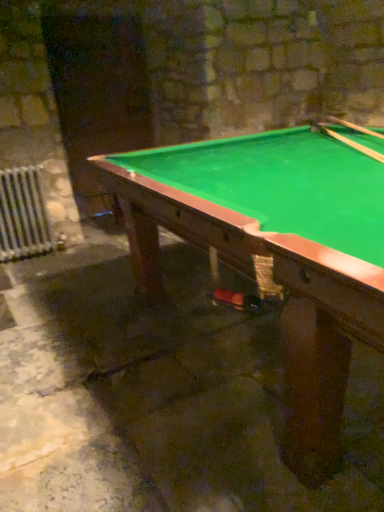
Question: From the image's perspective, is green felt pool table at center on white metal radiator at lower left?

Choices:
 (A) yes
 (B) no

Answer: (B)

Question: Is green felt pool table at center to the left of white metal radiator at lower left from the viewer's perspective?

Choices:
 (A) no
 (B) yes

Answer: (A)

Question: Is green felt pool table at center far away from white metal radiator at lower left?

Choices:
 (A) no
 (B) yes

Answer: (B)

Question: Considering the relative sizes of green felt pool table at center and white metal radiator at lower left in the image provided, is green felt pool table at center shorter than white metal radiator at lower left?

Choices:
 (A) no
 (B) yes

Answer: (A)

Question: Can you confirm if green felt pool table at center is wider than white metal radiator at lower left?

Choices:
 (A) no
 (B) yes

Answer: (B)

Question: Considering the positions of green felt pool table at center and wooden smooth cue at upper right, placed as the first cue when sorted from right to left, in the image, is green felt pool table at center taller or shorter than wooden smooth cue at upper right, placed as the first cue when sorted from right to left,?

Choices:
 (A) tall
 (B) short

Answer: (A)

Question: From the image's perspective, relative to wooden smooth cue at upper right, placed as the first cue when sorted from right to left, is green felt pool table at center above or below?

Choices:
 (A) above
 (B) below

Answer: (B)

Question: Based on their sizes in the image, would you say green felt pool table at center is bigger or smaller than wooden smooth cue at upper right, the 2th cue viewed from the left?

Choices:
 (A) big
 (B) small

Answer: (A)

Question: In the image, is green felt pool table at center on the left side or the right side of wooden smooth cue at upper right, the 2th cue viewed from the left?

Choices:
 (A) left
 (B) right

Answer: (A)

Question: Is green felt pool table at center bigger or smaller than white metal radiator at lower left?

Choices:
 (A) big
 (B) small

Answer: (A)

Question: Is green felt pool table at center to the left or to the right of white metal radiator at lower left in the image?

Choices:
 (A) left
 (B) right

Answer: (B)

Question: In the image, is green felt pool table at center positioned in front of or behind white metal radiator at lower left?

Choices:
 (A) behind
 (B) front

Answer: (B)

Question: Considering the positions of green felt pool table at center and white metal radiator at lower left in the image, is green felt pool table at center taller or shorter than white metal radiator at lower left?

Choices:
 (A) short
 (B) tall

Answer: (B)

Question: In terms of width, does wooden smooth cue at upper right, the 2th cue viewed from the left, look wider or thinner when compared to green felt pool table at center?

Choices:
 (A) wide
 (B) thin

Answer: (B)

Question: From the image's perspective, relative to green felt pool table at center, is wooden smooth cue at upper right, the 2th cue viewed from the left, above or below?

Choices:
 (A) above
 (B) below

Answer: (A)